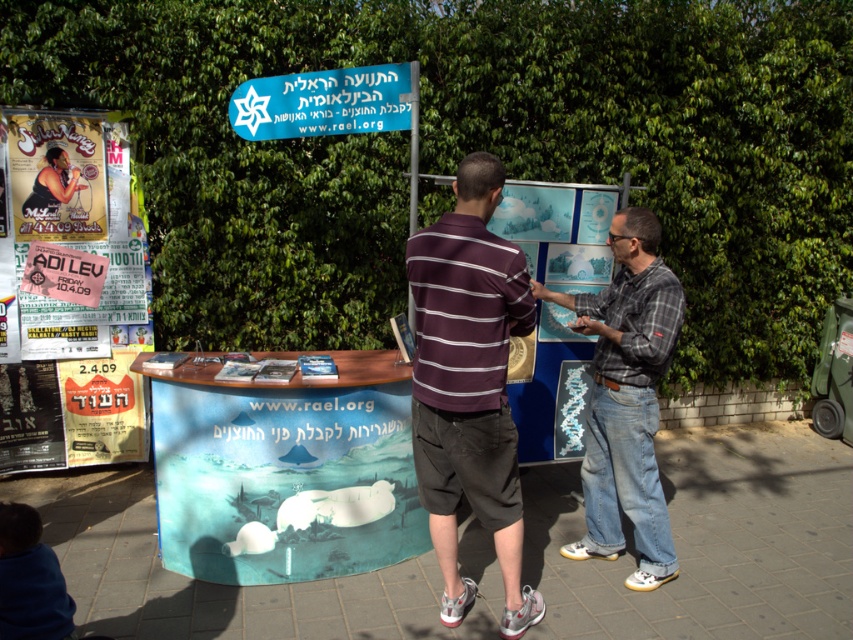
Who is lower down, paper posters at left or plaid shirt at center?

plaid shirt at center is below.

In the scene shown: Measure the distance between point (x=91, y=385) and camera.

Point (x=91, y=385) and camera are 4.52 meters apart.

At what (x,y) coordinates should I click in order to perform the action: click on paper posters at left. Please return your answer as a coordinate pair (x, y). Looking at the image, I should click on (74, 296).

Does plaid shirt at center appear over blue plastic sign at upper center?

No.

Is point (646, 378) less distant than point (416, 72)?

Yes, it is.

Is point (637, 506) more distant than point (396, 109)?

No.

Where is `plaid shirt at center`? The width and height of the screenshot is (853, 640). plaid shirt at center is located at coordinates (625, 397).

Between dark purple striped shirt at center and blue plastic sign at upper center, which one appears on the right side from the viewer's perspective?

dark purple striped shirt at center is more to the right.

Does dark purple striped shirt at center appear on the left side of blue plastic sign at upper center?

In fact, dark purple striped shirt at center is to the right of blue plastic sign at upper center.

Who is more forward, (444, 356) or (332, 132)?

Point (444, 356) is in front.

Locate an element on the screen. The height and width of the screenshot is (640, 853). dark purple striped shirt at center is located at coordinates (469, 385).